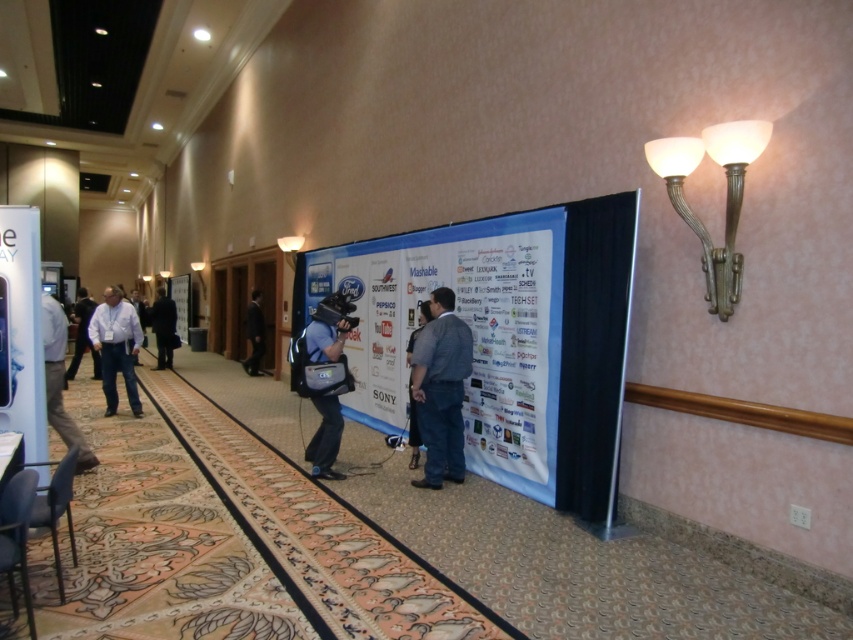
Question: Among these points, which one is farthest from the camera?

Choices:
 (A) (303, 336)
 (B) (461, 275)
 (C) (91, 362)

Answer: (C)

Question: Does dark gray suit at center appear on the left side of blue fabric camera at center?

Choices:
 (A) yes
 (B) no

Answer: (B)

Question: Which point appears farthest from the camera in this image?

Choices:
 (A) (245, 369)
 (B) (346, 320)

Answer: (A)

Question: Is dark blue suit at center in front of black suit at center?

Choices:
 (A) no
 (B) yes

Answer: (A)

Question: Based on their relative distances, which object is nearer to the light blue shirt at center?

Choices:
 (A) white shirt at left
 (B) blue fabric poster at center
 (C) light blue shirt at left

Answer: (C)

Question: Is light blue shirt at left in front of white shirt at left?

Choices:
 (A) no
 (B) yes

Answer: (A)